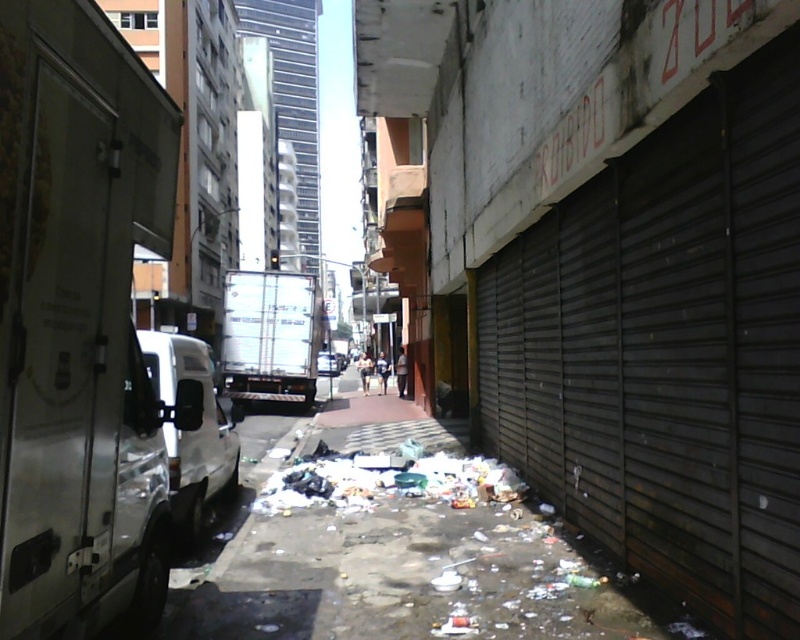
The image size is (800, 640). Describe the element at coordinates (398, 554) in the screenshot. I see `dirty concrete pavement at center` at that location.

Locate an element on the screen. This screenshot has height=640, width=800. dirty concrete pavement at center is located at coordinates (398, 554).

Who is more forward, (576, 548) or (322, 355)?

Positioned in front is point (576, 548).

Where is `dirty concrete pavement at center`? The image size is (800, 640). dirty concrete pavement at center is located at coordinates pyautogui.click(x=398, y=554).

Who is positioned more to the right, white metallic van at left or white matte van at center?

white metallic van at left

Describe the element at coordinates (80, 324) in the screenshot. I see `white metallic van at left` at that location.

Which is in front, point (28, 176) or point (326, 369)?

Positioned in front is point (28, 176).

Locate an element on the screen. The image size is (800, 640). white metallic van at left is located at coordinates (80, 324).

Is trashy plastic bags at center further to camera compared to white metallic truck at center?

No, it is not.

Between point (413, 440) and point (288, 285), which one is positioned in front?

Positioned in front is point (413, 440).

In order to click on trashy plastic bags at center in this screenshot , I will do `click(388, 480)`.

Identify the location of trashy plastic bags at center. This screenshot has width=800, height=640. (388, 480).